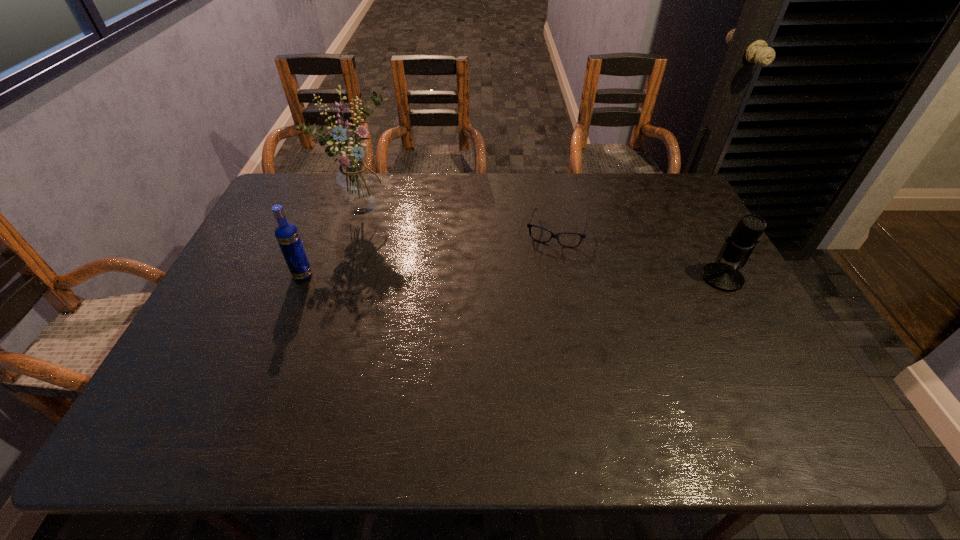
This screenshot has height=540, width=960. I want to click on vacant space situated on the front-facing side of the bouquet, so click(x=404, y=234).

At what (x,y) coordinates should I click in order to perform the action: click on free space located on the front-facing side of the bouquet. Please return your answer as a coordinate pair (x, y). The height and width of the screenshot is (540, 960). Looking at the image, I should click on [x=468, y=281].

Locate an element on the screen. free point located 0.320m on the front-facing side of the bouquet is located at coordinates (452, 269).

The width and height of the screenshot is (960, 540). Identify the location of object that is at the far edge. (357, 189).

Where is `object present at the right edge`? object present at the right edge is located at coordinates (738, 246).

Locate an element on the screen. vacant space at the far edge of the desktop is located at coordinates (558, 195).

In the image, there is a desktop. Where is `vacant area at the near edge`? vacant area at the near edge is located at coordinates (291, 396).

Where is `vacant space at the left edge of the desktop`? The width and height of the screenshot is (960, 540). vacant space at the left edge of the desktop is located at coordinates (214, 355).

In the image, there is a desktop. Identify the location of vacant space at the right edge. The height and width of the screenshot is (540, 960). (721, 320).

Locate an element on the screen. This screenshot has height=540, width=960. vacant position at the far right corner of the desktop is located at coordinates (683, 189).